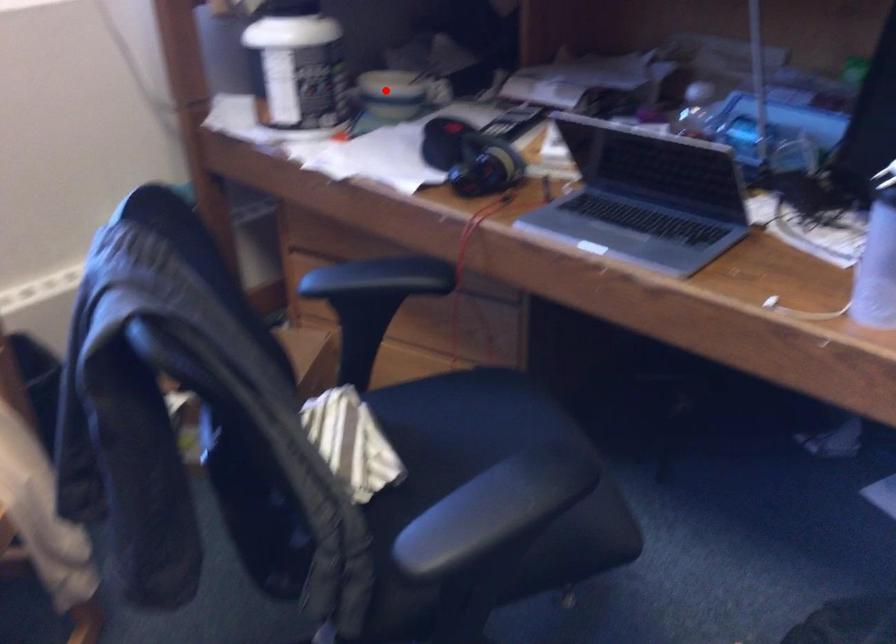
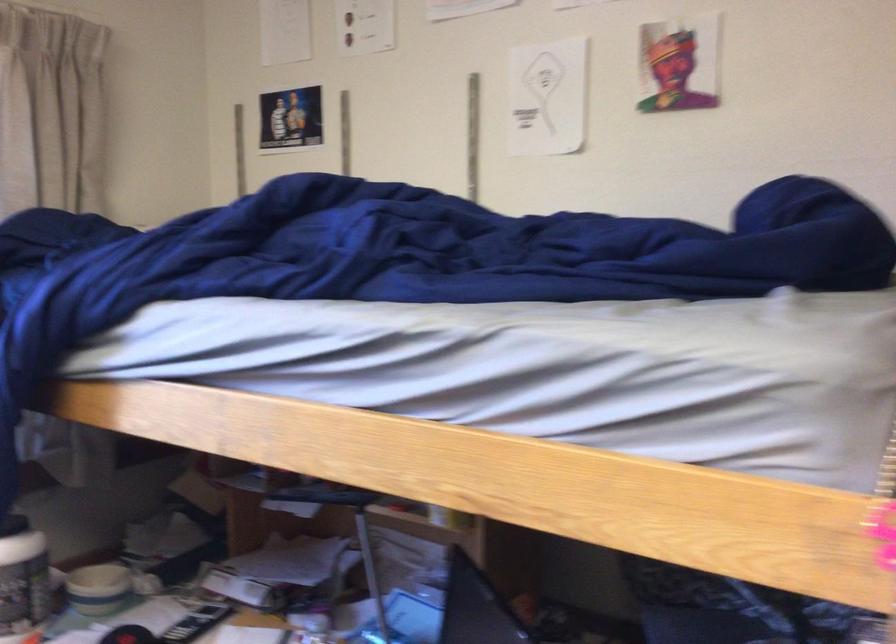
Question: I am providing you with two images of the same scene from different viewpoints. In image1, a red point is highlighted. Considering the same 3D point in image2, which of the following is correct?

Choices:
 (A) It is closer
 (B) It is farther

Answer: (B)